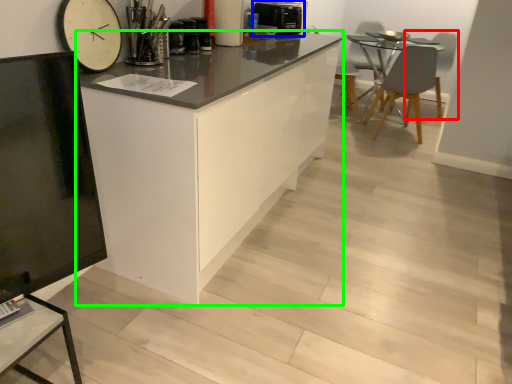
Question: Which object is positioned farthest from swivel chair (highlighted by a red box)? Select from appliance (highlighted by a blue box) and cabinetry (highlighted by a green box).

Choices:
 (A) appliance
 (B) cabinetry

Answer: (B)